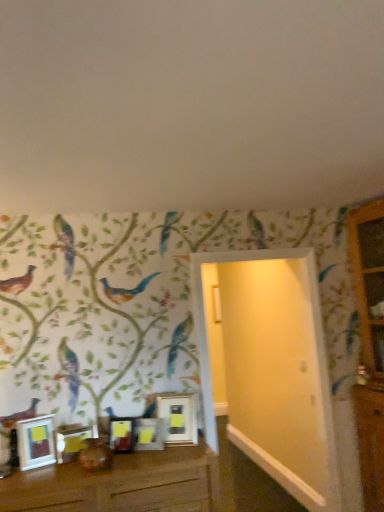
Identify the location of vacant region under matte brown vase at center (from a real-world perspective). The width and height of the screenshot is (384, 512). (98, 469).